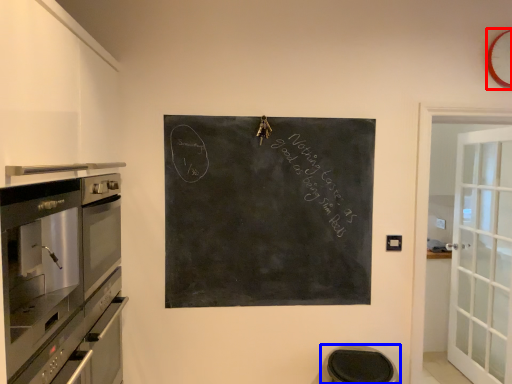
Question: Which of the following is the farthest to the observer, clock (highlighted by a red box) or step stool (highlighted by a blue box)?

Choices:
 (A) clock
 (B) step stool

Answer: (A)